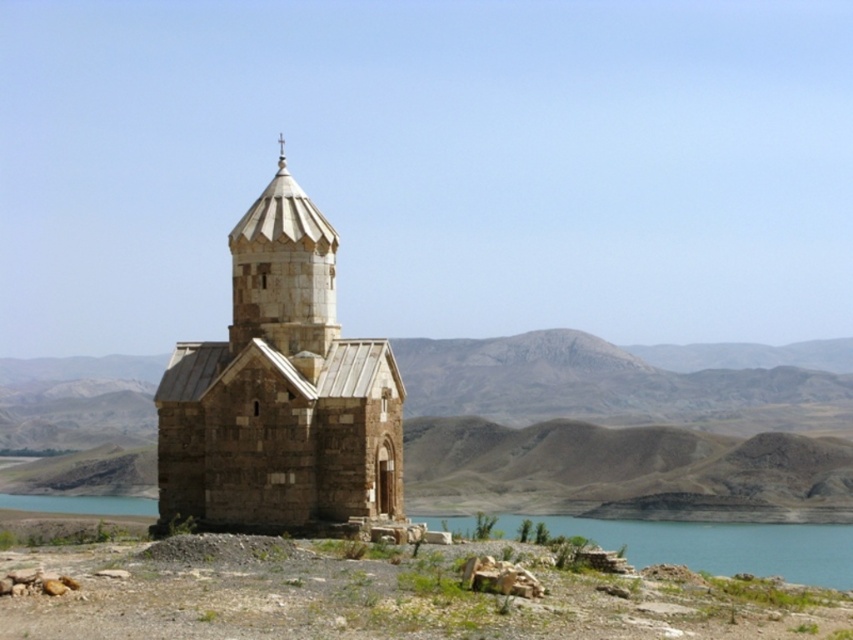
You are a hiker who wants to take a photo of the stone church at center and the blue water at lower center. Which object should you focus on first if you want to capture both in a single frame without moving the camera?

The stone church at center is taller than blue water at lower center, so you should focus on the stone church at center first to ensure it fits within the frame.

You are a hiker who has just arrived at the stone church at center. You want to get to the blue water at lower center. Which direction should you move relative to the church?

The stone church at center is located above blue water at lower center, so you should move downward towards the blue water at lower center to reach it.

Consider the image. You are a photographer planning to capture the stone church at center and the blue water at lower center in a single shot. Based on their widths, which object should you position closer to the center of the frame to ensure both are fully visible?

The stone church at center is thinner than blue water at lower center, so positioning the stone church at center closer to the center of the frame will allow both objects to be fully visible while accommodating their widths.